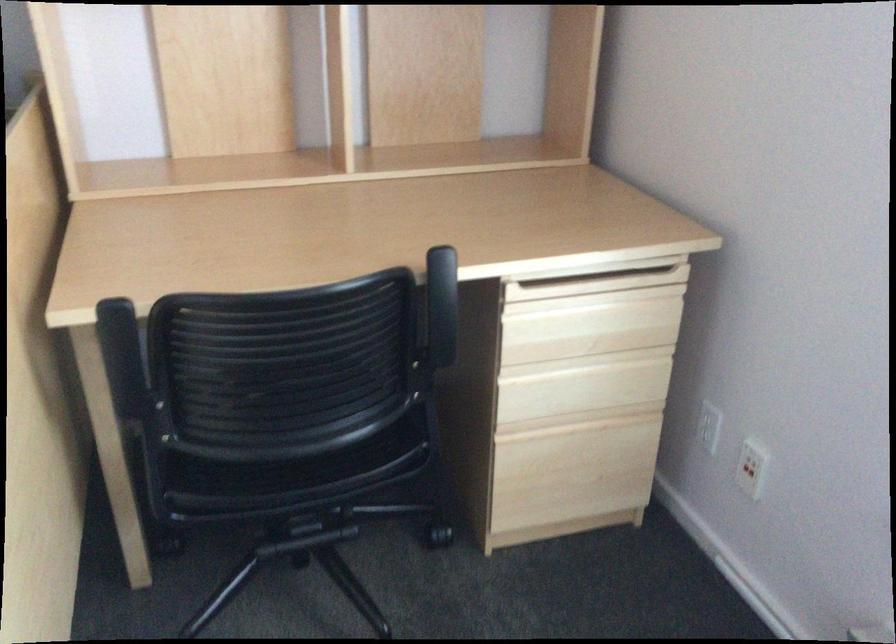
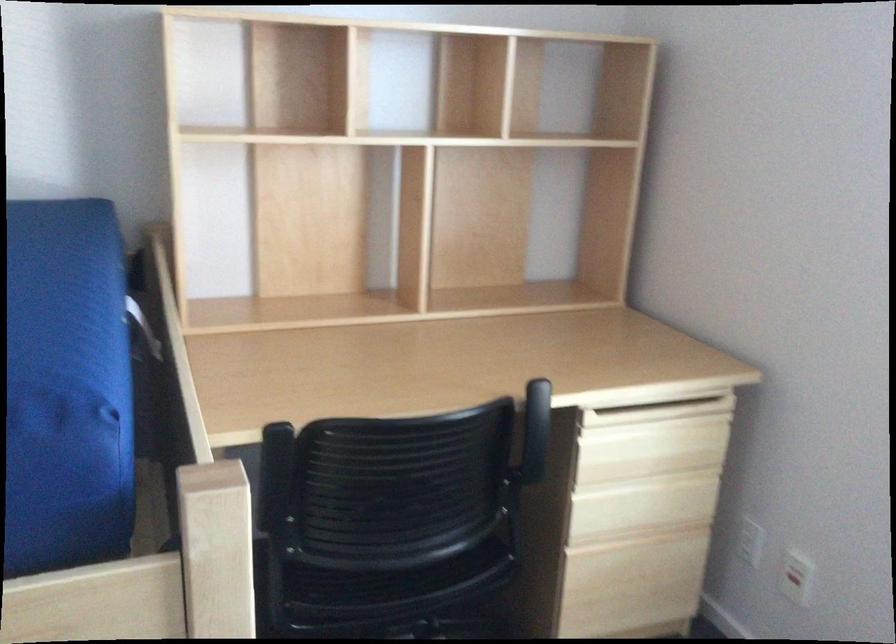
The point at (748, 469) is marked in the first image. Where is the corresponding point in the second image?

(795, 583)